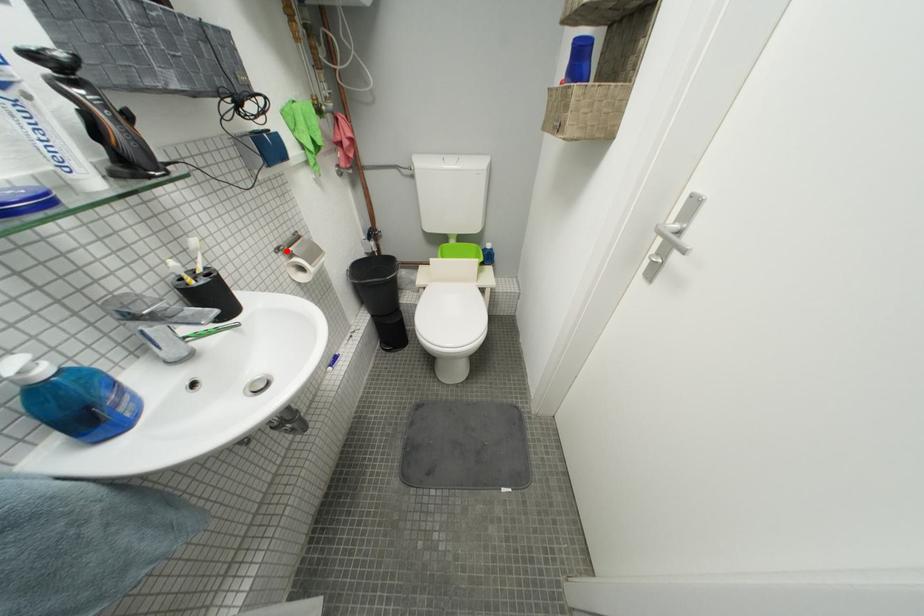
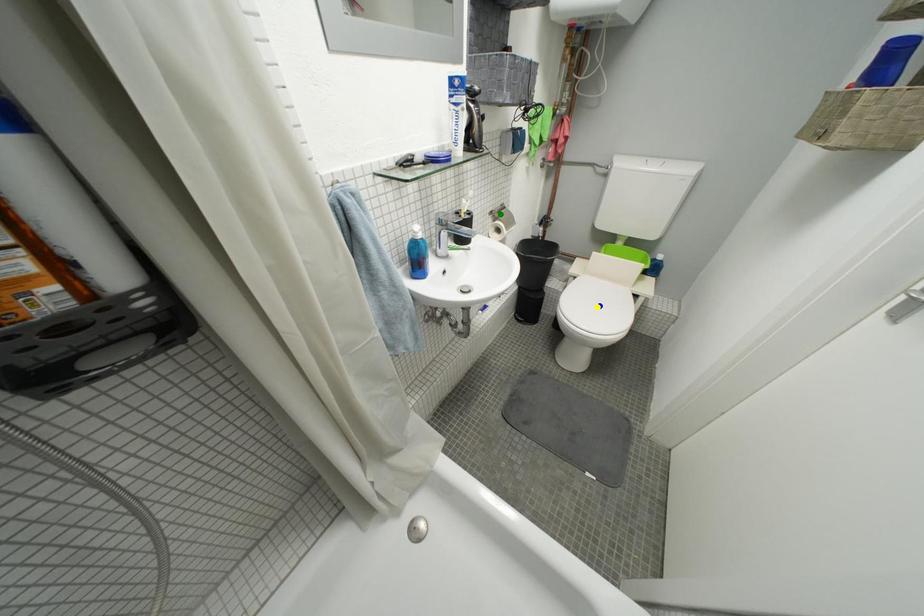
Question: I am providing you with two images of the same scene from different viewpoints. A red point is marked on the first image. You are given multiple points on the second image. Which mark in image 2 goes with the point in image 1?

Choices:
 (A) green point
 (B) blue point
 (C) yellow point

Answer: (A)